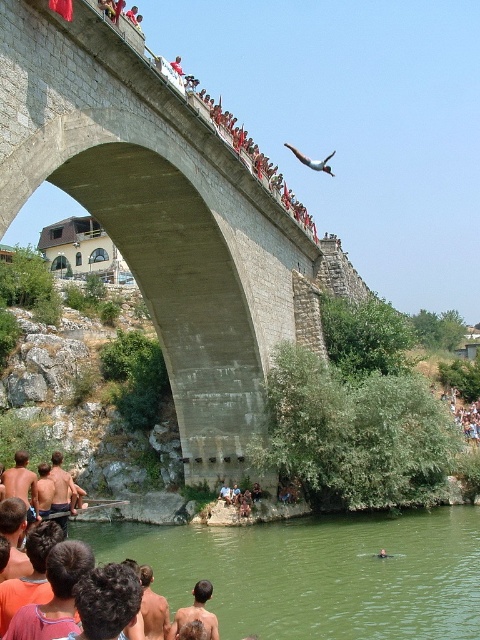
Is concrete bridge at center positioned behind green water at lower center?

No, concrete bridge at center is in front of green water at lower center.

Which is below, concrete bridge at center or green water at lower center?

green water at lower center is below.

Locate an element on the screen. concrete bridge at center is located at coordinates (157, 216).

What are the coordinates of `concrete bridge at center` in the screenshot? It's located at (157, 216).

Is brown hair at lower center wider than smooth white airplane at upper center?

No, brown hair at lower center is not wider than smooth white airplane at upper center.

Who is more forward, (213,628) or (321,163)?

Point (213,628)

Image resolution: width=480 pixels, height=640 pixels. I want to click on brown hair at lower center, so click(x=196, y=612).

Between brown hair at lower center and blue denim shorts at lower center, which one is positioned higher?

blue denim shorts at lower center is above.

What do you see at coordinates (196, 612) in the screenshot? I see `brown hair at lower center` at bounding box center [196, 612].

Between point (171, 628) and point (255, 490), which one is positioned in front?

Point (171, 628) is more forward.

This screenshot has width=480, height=640. Identify the location of brown hair at lower center. (196, 612).